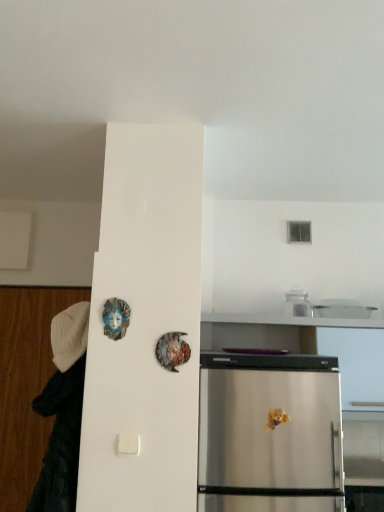
At what (x,y) coordinates should I click in order to perform the action: click on free location above white fabric at left (from a real-world perspective). Please return your answer as a coordinate pair (x, y). Image resolution: width=384 pixels, height=512 pixels. Looking at the image, I should click on (44, 286).